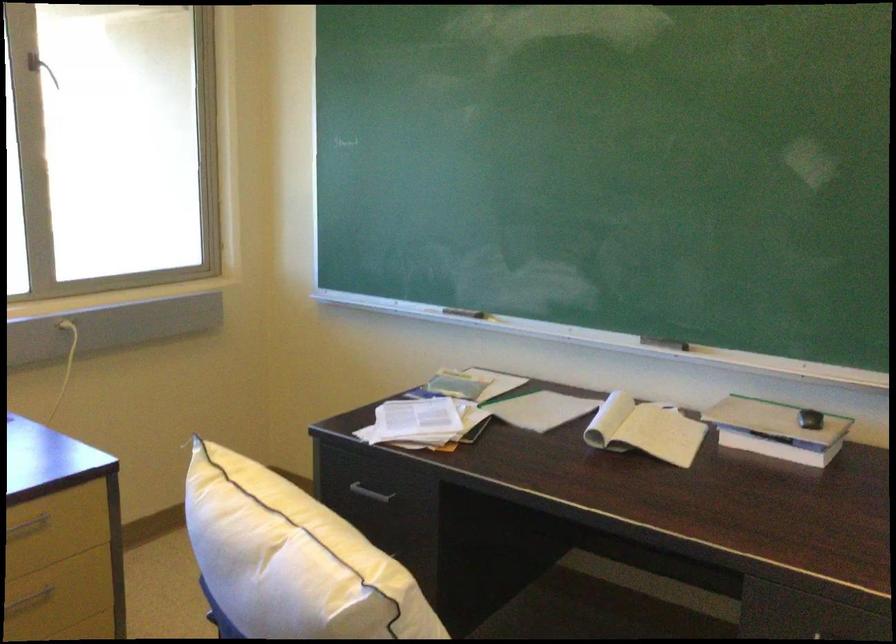
Which object does [776,430] point to?

This point indicates the book on desk.